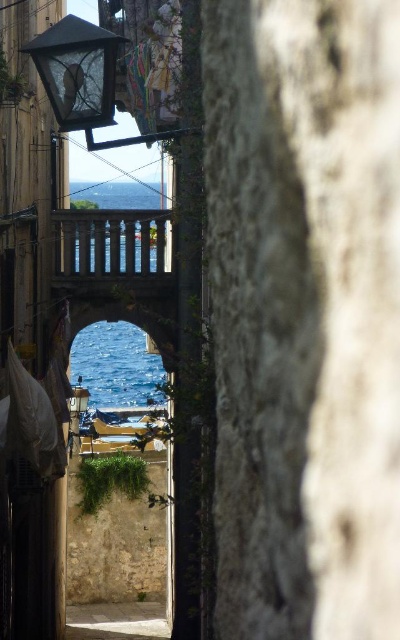
You are a photographer standing in the alleyway and want to capture the stone balustrade at center and the blue glass water at upper center in the same frame. Based on their positions, which object should you focus on to ensure both are in focus?

The stone balustrade at center is positioned under blue glass water at upper center, so focusing on the stone balustrade at center would ensure both are in focus since it is closer to the camera.

You are standing at the entrance of the alleyway and want to reach the stone balustrade at center. Which direction should you walk to get there from your current position?

The stone balustrade at center is located at point (x=110, y=248), so you should walk towards the center of the alleyway to reach it.